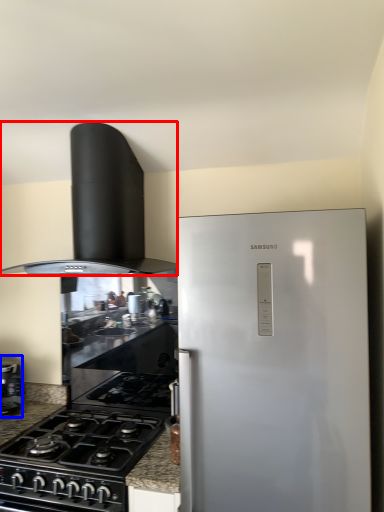
Question: Which object appears farthest to the camera in this image, home appliance (highlighted by a red box) or kitchen appliance (highlighted by a blue box)?

Choices:
 (A) home appliance
 (B) kitchen appliance

Answer: (B)